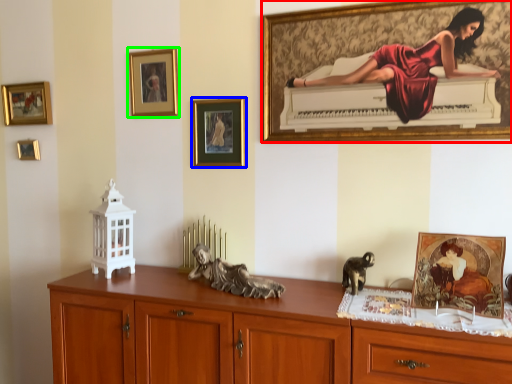
Question: Which is farther away from picture frame (highlighted by a red box)? picture frame (highlighted by a blue box) or picture frame (highlighted by a green box)?

Choices:
 (A) picture frame
 (B) picture frame

Answer: (B)